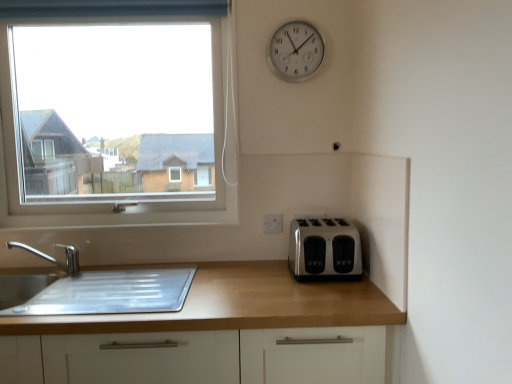
The height and width of the screenshot is (384, 512). Describe the element at coordinates (272, 223) in the screenshot. I see `white plastic electric outlet at center` at that location.

In order to face satin silver toaster at lower right, should I rotate leftwards or rightwards?

Rotate your view right by about 9.175°.

At what (x,y) coordinates should I click in order to perform the action: click on wooden at right. Please return your answer as a coordinate pair (x, y). Looking at the image, I should click on (242, 307).

From a real-world perspective, is satin silver toaster at lower right physically located above or below wooden at right?

satin silver toaster at lower right is above wooden at right.

Based on the photo, can you see satin silver toaster at lower right touching wooden at right?

No, satin silver toaster at lower right is not in contact with wooden at right.

Is point (342, 224) closer or farther from the camera than point (273, 322)?

Point (342, 224).

Which is correct: silver metallic clock at upper right is inside wooden at right, or outside of it?

silver metallic clock at upper right is not inside wooden at right, it's outside.

Where is `clock lying above the wooden at right (from the image's perspective)`? The height and width of the screenshot is (384, 512). clock lying above the wooden at right (from the image's perspective) is located at coordinates (296, 51).

From a real-world perspective, is silver metallic clock at upper right above or below wooden at right?

silver metallic clock at upper right is situated higher than wooden at right in the real world.

Measure the distance from silver metallic clock at upper right to wooden at right.

A distance of 38.33 inches exists between silver metallic clock at upper right and wooden at right.

From the picture: What's the angular difference between white plastic electric outlet at center and silver metallic clock at upper right's facing directions?

The angular difference between white plastic electric outlet at center and silver metallic clock at upper right is 3.72 degrees.

Is white plastic electric outlet at center not near silver metallic clock at upper right?

No, there isn't a large distance between white plastic electric outlet at center and silver metallic clock at upper right.

From a real-world perspective, between white plastic electric outlet at center and silver metallic clock at upper right, who is vertically higher?

silver metallic clock at upper right, from a real-world perspective.

How much distance is there between white plastic electric outlet at center and silver metallic clock at upper right?

A distance of 27.12 inches exists between white plastic electric outlet at center and silver metallic clock at upper right.

Which is nearer, (111,160) or (324,302)?

Point (111,160).

Considering the relative sizes of clear glass window at upper left and wooden at right in the image provided, is clear glass window at upper left smaller than wooden at right?

Yes, clear glass window at upper left is smaller than wooden at right.

How much distance is there between clear glass window at upper left and wooden at right?

clear glass window at upper left and wooden at right are 2.37 meters apart.

From the image's perspective, would you say clear glass window at upper left is shown under wooden at right?

Actually, clear glass window at upper left appears above wooden at right in the image.

From the image's perspective, is satin silver toaster at lower right above or below silver metallic faucet at lower left?

satin silver toaster at lower right is situated higher than silver metallic faucet at lower left in the image.

How many degrees apart are the facing directions of satin silver toaster at lower right and silver metallic faucet at lower left?

satin silver toaster at lower right and silver metallic faucet at lower left are facing 2.01 degrees away from each other.

From a real-world perspective, who is located higher, satin silver toaster at lower right or silver metallic faucet at lower left?

In real-world perspective, satin silver toaster at lower right is above.

Is satin silver toaster at lower right wider than silver metallic faucet at lower left?

Yes.

Which object is thinner, satin silver toaster at lower right or silver metallic clock at upper right?

With smaller width is silver metallic clock at upper right.

Does satin silver toaster at lower right have a greater height compared to silver metallic clock at upper right?

No.

Is silver metallic clock at upper right at the back of satin silver toaster at lower right?

No, satin silver toaster at lower right is not facing away from silver metallic clock at upper right.

Is satin silver toaster at lower right bigger or smaller than silver metallic clock at upper right?

Considering their sizes, satin silver toaster at lower right takes up more space than silver metallic clock at upper right.

Between wooden at right and silver metallic faucet at lower left, which one has less height?

silver metallic faucet at lower left.

Which point is more forward, (394, 306) or (68, 255)?

The point (394, 306) is closer.

How far apart are wooden at right and silver metallic faucet at lower left?

wooden at right is 33.91 inches from silver metallic faucet at lower left.

Find the location of a particular element. The height and width of the screenshot is (384, 512). tap above the wooden at right (from the image's perspective) is located at coordinates (52, 257).

This screenshot has width=512, height=384. What are the coordinates of `countertop located below the satin silver toaster at lower right (from the image's perspective)` in the screenshot? It's located at (242, 307).

Image resolution: width=512 pixels, height=384 pixels. In order to click on clock that is behind the wooden at right in this screenshot , I will do `click(296, 51)`.

From the image, which object appears to be nearer to wooden at right, silver metallic faucet at lower left or clear glass window at upper left?

silver metallic faucet at lower left is positioned closer to the anchor wooden at right.

Which object lies further to the anchor point white plastic electric outlet at center, satin silver toaster at lower right or silver metallic clock at upper right?

silver metallic clock at upper right.

Which object lies nearer to the anchor point wooden at right, silver metallic faucet at lower left or white plastic electric outlet at center?

white plastic electric outlet at center.

Considering their positions, is wooden at right positioned further to white plastic electric outlet at center than silver metallic faucet at lower left?

The object further to white plastic electric outlet at center is silver metallic faucet at lower left.

From the image, which object appears to be nearer to clear glass window at upper left, silver metallic faucet at lower left or satin silver toaster at lower right?

Based on the image, silver metallic faucet at lower left appears to be nearer to clear glass window at upper left.

Based on their spatial positions, is silver metallic clock at upper right or clear glass window at upper left further from satin silver toaster at lower right?

Among the two, clear glass window at upper left is located further to satin silver toaster at lower right.

Based on their spatial positions, is wooden at right or clear glass window at upper left further from silver metallic faucet at lower left?

clear glass window at upper left lies further to silver metallic faucet at lower left than the other object.

Based on their spatial positions, is silver metallic clock at upper right or white plastic electric outlet at center closer to clear glass window at upper left?

silver metallic clock at upper right is positioned closer to the anchor clear glass window at upper left.

Find the location of `electric outlet situated between silver metallic faucet at lower left and silver metallic clock at upper right from left to right`. electric outlet situated between silver metallic faucet at lower left and silver metallic clock at upper right from left to right is located at coordinates (272, 223).

What are the coordinates of `electric outlet situated between silver metallic faucet at lower left and satin silver toaster at lower right from left to right` in the screenshot? It's located at (272, 223).

Where is `window between silver metallic faucet at lower left and white plastic electric outlet at center in the horizontal direction`? window between silver metallic faucet at lower left and white plastic electric outlet at center in the horizontal direction is located at coordinates (122, 134).

At what (x,y) coordinates should I click in order to perform the action: click on electric outlet between silver metallic clock at upper right and wooden at right in the vertical direction. Please return your answer as a coordinate pair (x, y). Looking at the image, I should click on (272, 223).